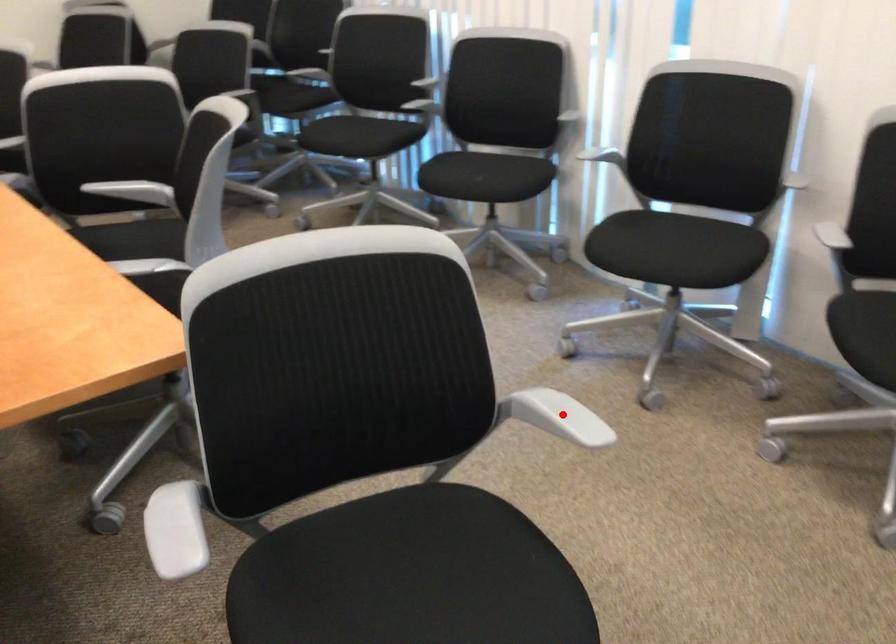
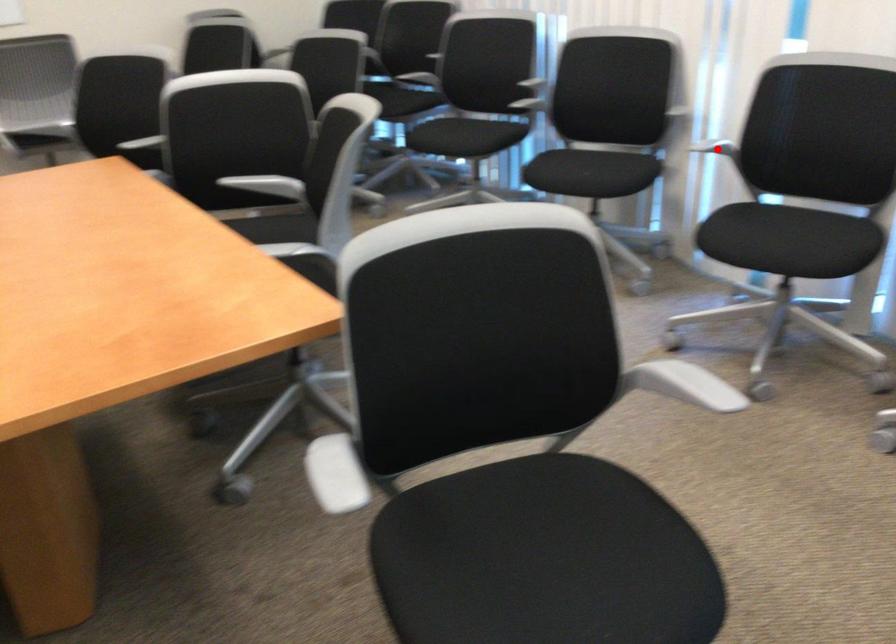
I am providing you with two images of the same scene from different viewpoints. A red point is marked on the first image and another point is marked on the second image. Is the marked point in image1 the same physical position as the marked point in image2?

No